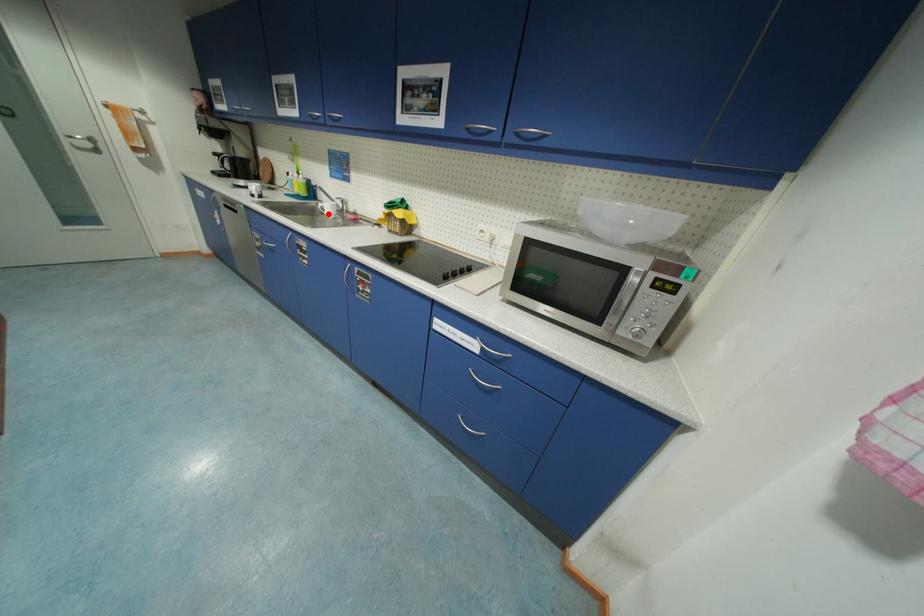
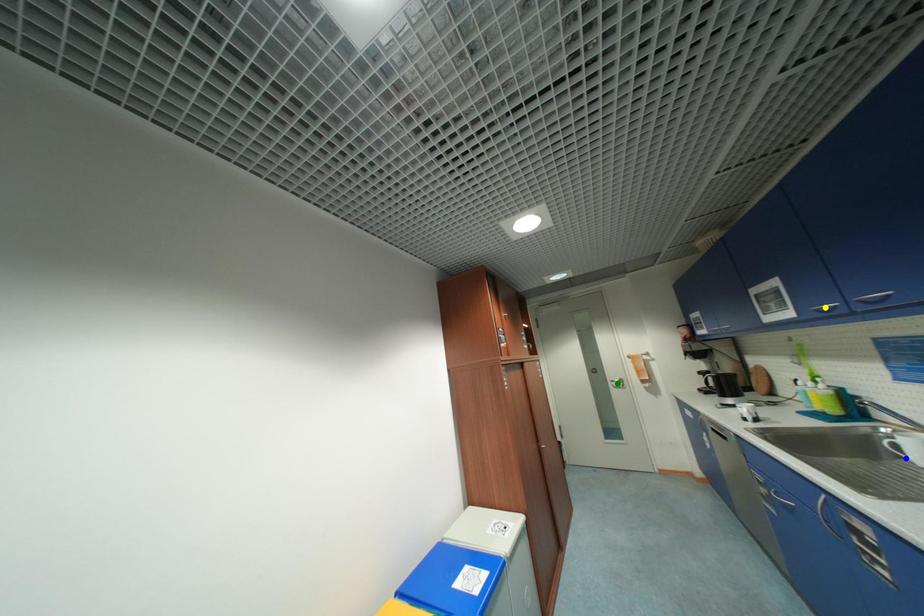
Question: I am providing you with two images of the same scene from different viewpoints. A red point is marked on the first image. You are given multiple points on the second image. Which mark in image 2 goes with the point in image 1?

Choices:
 (A) green point
 (B) yellow point
 (C) blue point

Answer: (C)